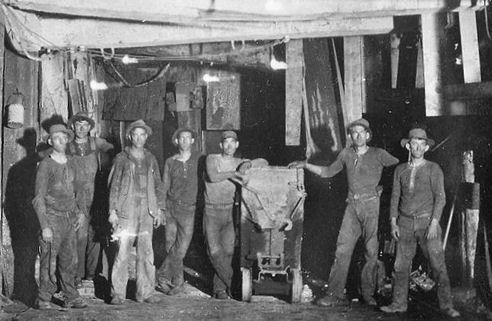
Find the location of a particular element. This screenshot has width=492, height=321. bucket is located at coordinates (16, 115).